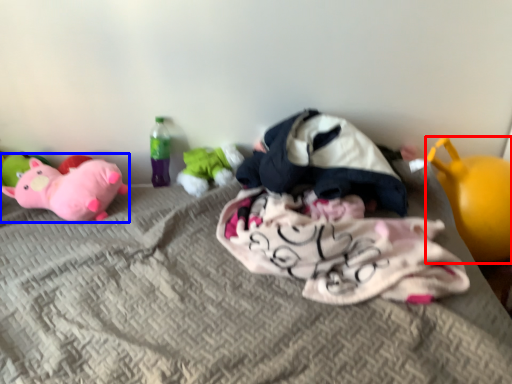
Question: Which object is closer to the camera taking this photo, toy (highlighted by a red box) or toy (highlighted by a blue box)?

Choices:
 (A) toy
 (B) toy

Answer: (A)